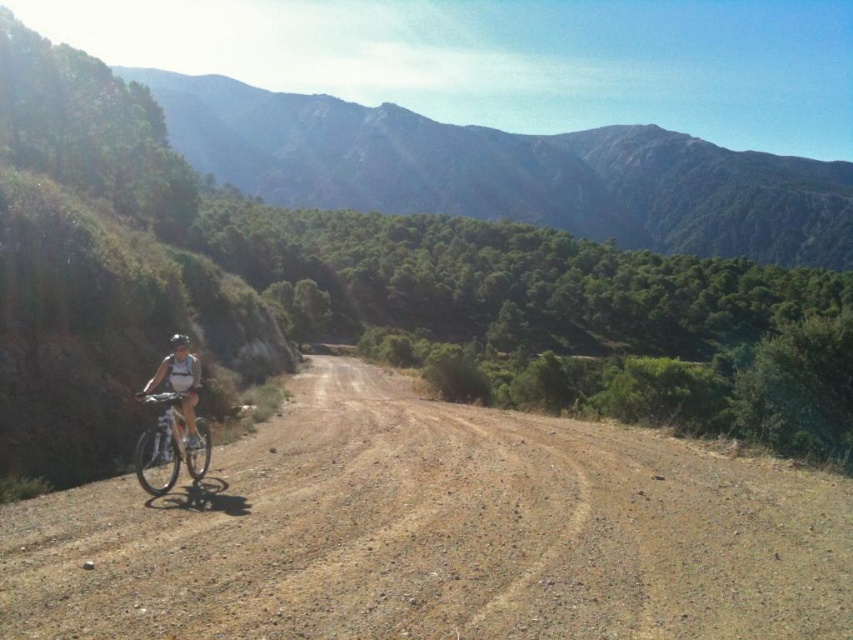
Does green forested mountain at upper center have a smaller size compared to silver metallic bicycle at center?

Incorrect, green forested mountain at upper center is not smaller in size than silver metallic bicycle at center.

Can you confirm if green forested mountain at upper center is positioned below silver metallic bicycle at center?

Incorrect, green forested mountain at upper center is not positioned below silver metallic bicycle at center.

What do you see at coordinates (511, 172) in the screenshot? I see `green forested mountain at upper center` at bounding box center [511, 172].

The height and width of the screenshot is (640, 853). I want to click on green forested mountain at upper center, so click(x=511, y=172).

Is brown gravel dirt track at center to the left of white matte helmet at center from the viewer's perspective?

In fact, brown gravel dirt track at center is to the right of white matte helmet at center.

Where is `brown gravel dirt track at center`? The width and height of the screenshot is (853, 640). brown gravel dirt track at center is located at coordinates (436, 532).

Find the location of a particular element. The image size is (853, 640). brown gravel dirt track at center is located at coordinates (436, 532).

Where is `brown gravel dirt track at center`? Image resolution: width=853 pixels, height=640 pixels. brown gravel dirt track at center is located at coordinates point(436,532).

Which is in front, point (483, 188) or point (175, 388)?

Point (175, 388) is in front.

Does green forested mountain at upper center appear on the right side of white matte helmet at center?

Correct, you'll find green forested mountain at upper center to the right of white matte helmet at center.

The image size is (853, 640). What do you see at coordinates (511, 172) in the screenshot?
I see `green forested mountain at upper center` at bounding box center [511, 172].

Locate an element on the screen. Image resolution: width=853 pixels, height=640 pixels. green forested mountain at upper center is located at coordinates (511, 172).